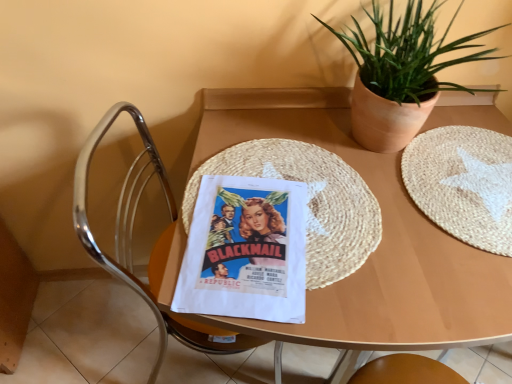
You are a GUI agent. You are given a task and a screenshot of the screen. Output one action in this format:
    pyautogui.click(x=<x>, y=<y>)
    Task: Click on the unoccupied space behind matte paper poster at center
    The width and height of the screenshot is (512, 384).
    Given the screenshot: What is the action you would take?
    pyautogui.click(x=281, y=145)